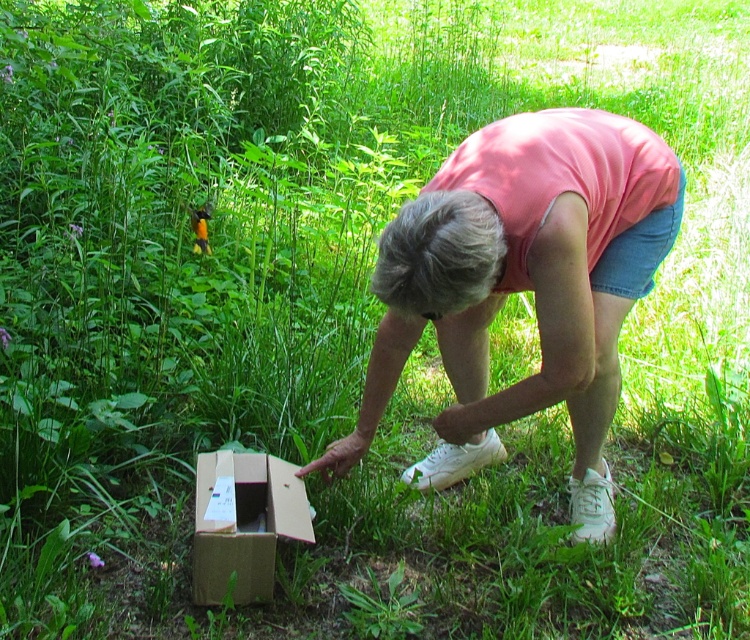
Is pink fabric squat at center closer to the viewer compared to cardboard box at lower left?

Yes, it is in front of cardboard box at lower left.

Does pink fabric squat at center appear over cardboard box at lower left?

Correct, pink fabric squat at center is located above cardboard box at lower left.

Locate an element on the screen. The width and height of the screenshot is (750, 640). pink fabric squat at center is located at coordinates (522, 285).